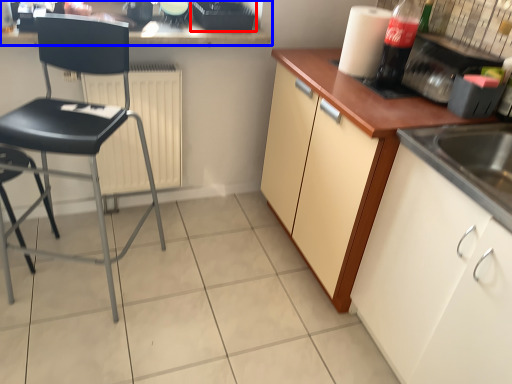
Question: Among these objects, which one is nearest to the camera, appliance (highlighted by a red box) or countertop (highlighted by a blue box)?

Choices:
 (A) appliance
 (B) countertop

Answer: (B)